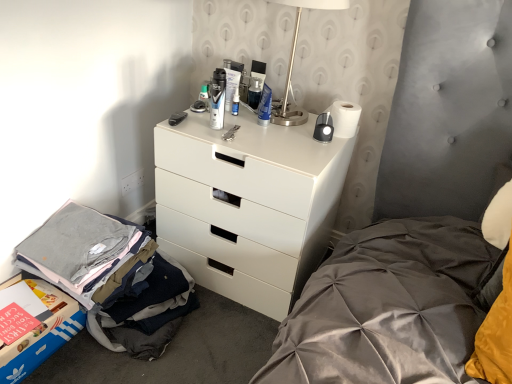
Identify the location of empty space that is to the right of matte black shaving cream can at center, acting as the 4th toiletry starting from the right. (260, 135).